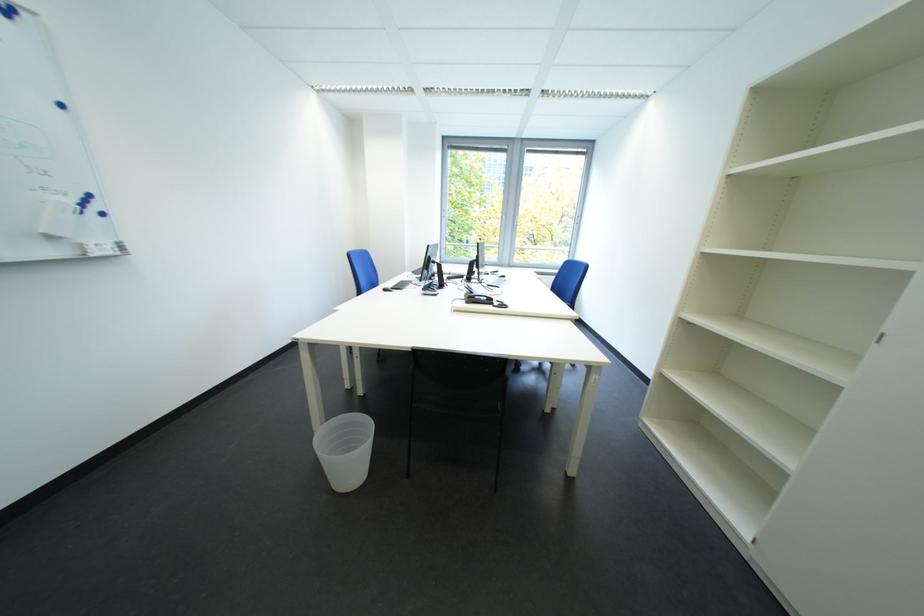
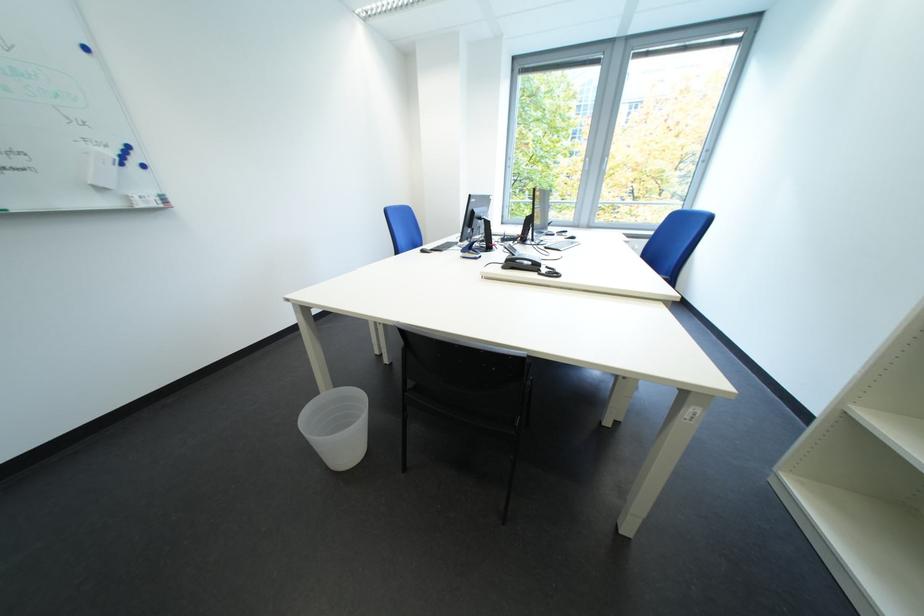
Where in the second image is the point corresponding to (x=123, y=254) from the first image?

(165, 208)